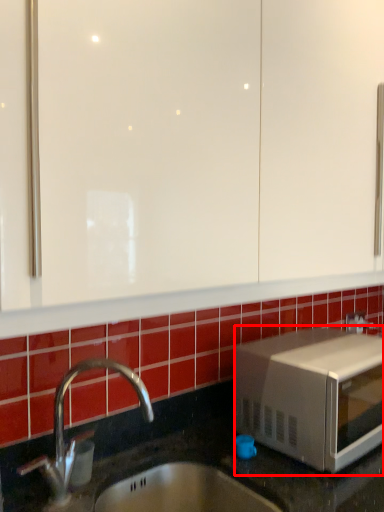
Question: From the image's perspective, where is microwave oven (annotated by the red box) located relative to soap dispenser?

Choices:
 (A) above
 (B) below

Answer: (A)